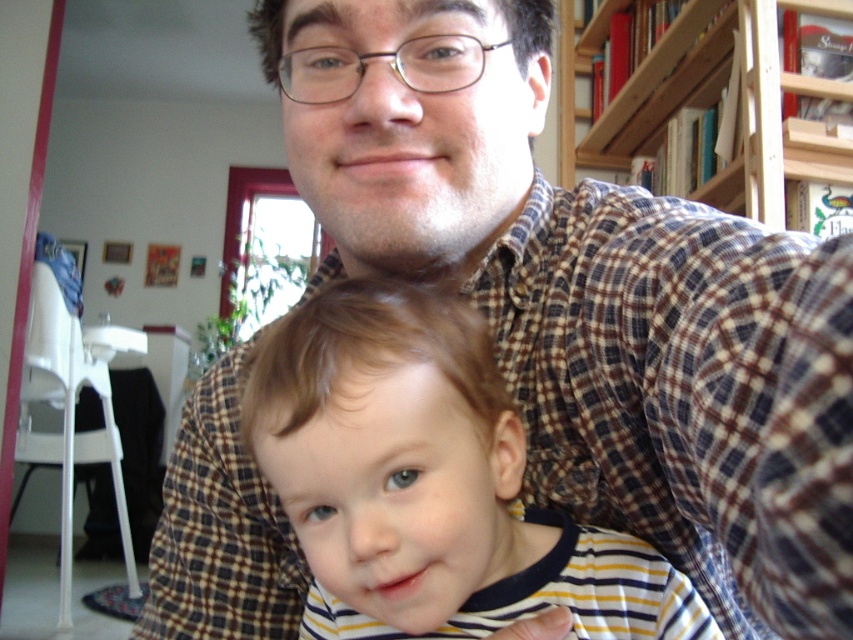
You are a photographer trying to capture a photo of the striped cotton shirt at center and the wooden bookshelf at upper right. Which object should you focus on first if you want to ensure both are in sharp focus?

The striped cotton shirt at center is closer to the camera than the wooden bookshelf at upper right. To ensure both are in sharp focus, focus on the striped cotton shirt at center first since it is closer, and the bookshelf will naturally be in focus due to depth of field.

You are organizing a photo album and notice the striped cotton shirt at center in the image. If you want to categorize this photo based on clothing items, which object should you use to determine the category?

The striped cotton shirt at center is the key object for categorizing this photo under clothing items related to shirts with striped patterns.

You are a photographer setting up for a family portrait. You need to ensure that the striped cotton shirt at center and the wooden bookshelf at upper right are both visible in the frame. Given their distance apart, will you need to adjust your camera angle to include both?

The striped cotton shirt at center is 1.38 meters away from the wooden bookshelf at upper right. Depending on the camera lens and framing, you may need to adjust the angle or zoom to ensure both are in the shot, as they are separated by over a meter.